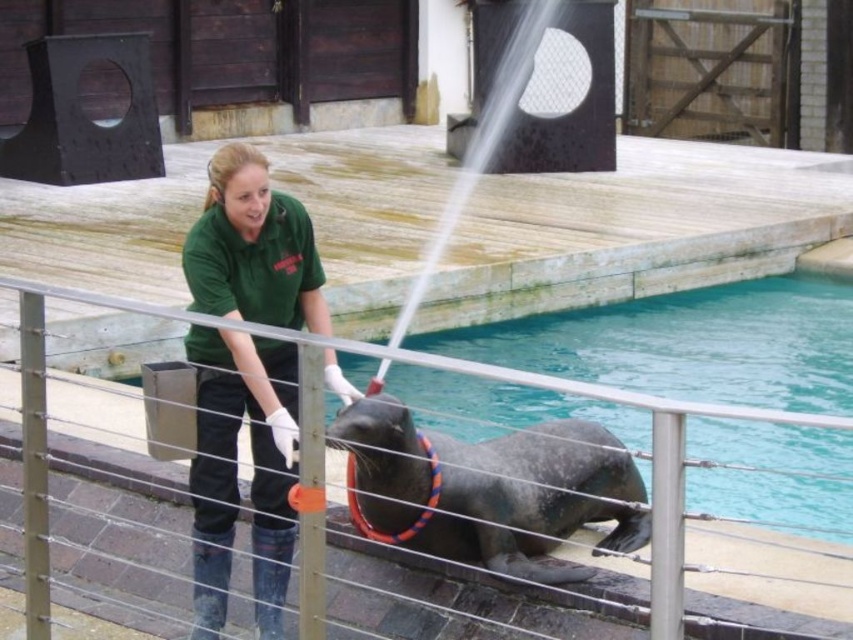
Between green uniform at center and gray rubber seal at center, which one has more height?

Standing taller between the two is green uniform at center.

Does green uniform at center have a greater width compared to gray rubber seal at center?

Incorrect, green uniform at center's width does not surpass gray rubber seal at center's.

Where is `green uniform at center`? Image resolution: width=853 pixels, height=640 pixels. green uniform at center is located at coordinates (236, 470).

Does green uniform at center come behind metal wire rail at center?

Yes, it is.

Can you confirm if green uniform at center is positioned to the left of metal wire rail at center?

Correct, you'll find green uniform at center to the left of metal wire rail at center.

What do you see at coordinates (236, 470) in the screenshot? This screenshot has width=853, height=640. I see `green uniform at center` at bounding box center [236, 470].

Locate an element on the screen. green uniform at center is located at coordinates (236, 470).

Which of these two, gray rubber seal at center or metal wire rail at center, stands shorter?

Standing shorter between the two is metal wire rail at center.

Is gray rubber seal at center thinner than metal wire rail at center?

Incorrect, gray rubber seal at center's width is not less than metal wire rail at center's.

Is point (479, 509) farther from viewer compared to point (782, 600)?

Yes, it is behind point (782, 600).

Locate an element on the screen. gray rubber seal at center is located at coordinates tap(492, 488).